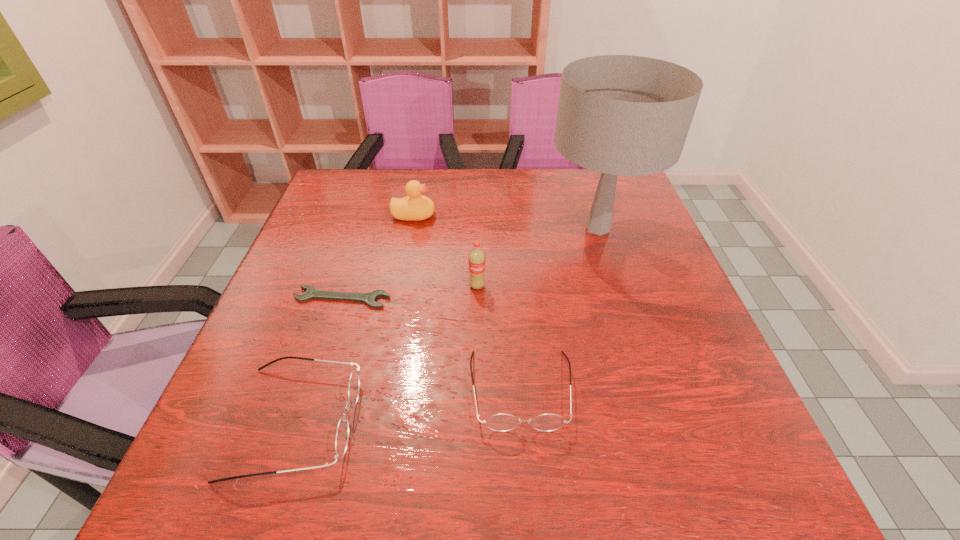
At what (x,y) coordinates should I click in order to perform the action: click on the left spectacles. Please return your answer as a coordinate pair (x, y). Image resolution: width=960 pixels, height=540 pixels. Looking at the image, I should click on (342, 433).

The image size is (960, 540). I want to click on the taller spectacles, so click(x=342, y=433).

The height and width of the screenshot is (540, 960). In order to click on the second shortest object in this screenshot , I will do `click(502, 422)`.

Where is `the right spectacles`? The image size is (960, 540). the right spectacles is located at coordinates (502, 422).

You are a GUI agent. You are given a task and a screenshot of the screen. Output one action in this format:
    pyautogui.click(x=<x>, y=<y>)
    Task: Click on the shortest object
    
    Given the screenshot: What is the action you would take?
    pyautogui.click(x=370, y=298)

You are a GUI agent. You are given a task and a screenshot of the screen. Output one action in this format:
    pyautogui.click(x=<x>, y=<y>)
    Task: Click on the fourth shortest object
    
    Given the screenshot: What is the action you would take?
    pyautogui.click(x=415, y=207)

This screenshot has width=960, height=540. What are the coordinates of `the tallest object` in the screenshot? It's located at (627, 115).

Find the location of a particular element. the rightmost object is located at coordinates (627, 115).

Image resolution: width=960 pixels, height=540 pixels. In order to click on the fifth shortest object in this screenshot , I will do `click(476, 260)`.

At what (x,y) coordinates should I click in order to perform the action: click on free location located through the lenses of the fourth tallest object. Please return your answer as a coordinate pair (x, y). Looking at the image, I should click on (430, 422).